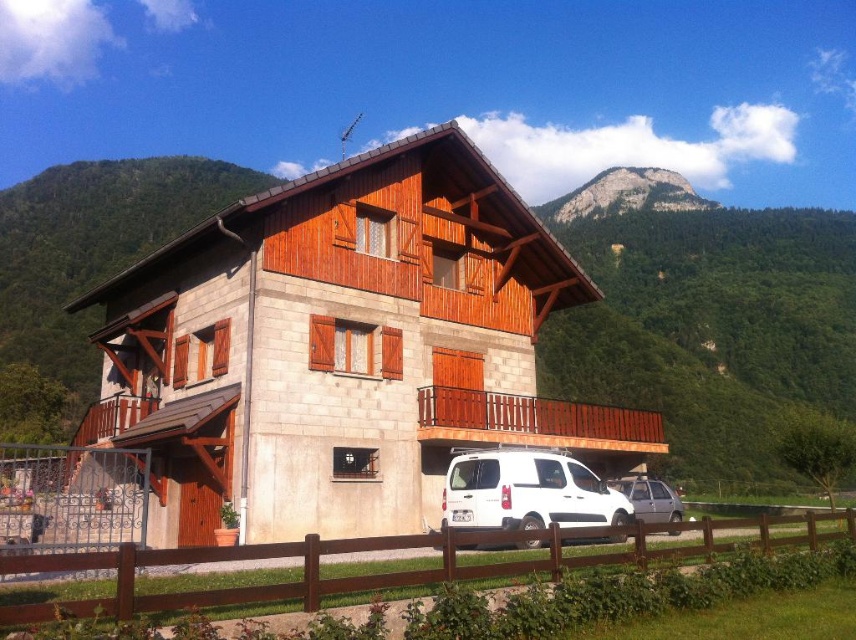
Is point (224, 550) behind point (556, 205)?

No.

Between point (431, 577) and point (694, 204), which one is positioned in front?

Positioned in front is point (431, 577).

What do you see at coordinates (381, 572) in the screenshot?
I see `brown wooden fence at lower center` at bounding box center [381, 572].

Find the location of a particular element. brown wooden fence at lower center is located at coordinates (381, 572).

Does point (30, 561) lie behind point (638, 506)?

No, (30, 561) is in front of (638, 506).

What do you see at coordinates (381, 572) in the screenshot?
I see `brown wooden fence at lower center` at bounding box center [381, 572].

The width and height of the screenshot is (856, 640). What do you see at coordinates (381, 572) in the screenshot?
I see `brown wooden fence at lower center` at bounding box center [381, 572].

Locate an element on the screen. The height and width of the screenshot is (640, 856). brown wooden fence at lower center is located at coordinates (381, 572).

From the picture: Is wooden chalet at center above rugged stone mountain at upper center?

Incorrect, wooden chalet at center is not positioned above rugged stone mountain at upper center.

Does point (253, 396) come closer to viewer compared to point (583, 212)?

Yes, point (253, 396) is in front of point (583, 212).

Which is behind, point (381, 273) or point (625, 179)?

The point (625, 179) is more distant.

The width and height of the screenshot is (856, 640). Find the location of `wooden chalet at center`. wooden chalet at center is located at coordinates (343, 348).